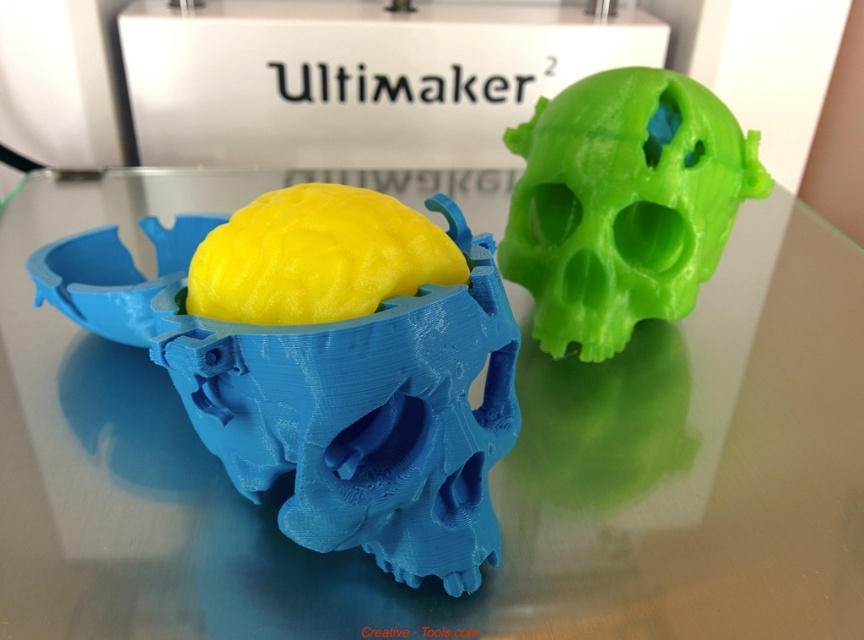
Question: Does transparent glass skull at center have a smaller size compared to green matte skull at upper right?

Choices:
 (A) no
 (B) yes

Answer: (A)

Question: Which object is closer to the camera taking this photo?

Choices:
 (A) green matte skull at upper right
 (B) transparent glass skull at center

Answer: (B)

Question: Which point is farther to the camera?

Choices:
 (A) (621, 536)
 (B) (586, 248)

Answer: (B)

Question: Which point is farther to the camera?

Choices:
 (A) transparent glass skull at center
 (B) green matte skull at upper right

Answer: (B)

Question: Does transparent glass skull at center have a greater width compared to green matte skull at upper right?

Choices:
 (A) no
 (B) yes

Answer: (B)

Question: Can you confirm if transparent glass skull at center is thinner than green matte skull at upper right?

Choices:
 (A) no
 (B) yes

Answer: (A)